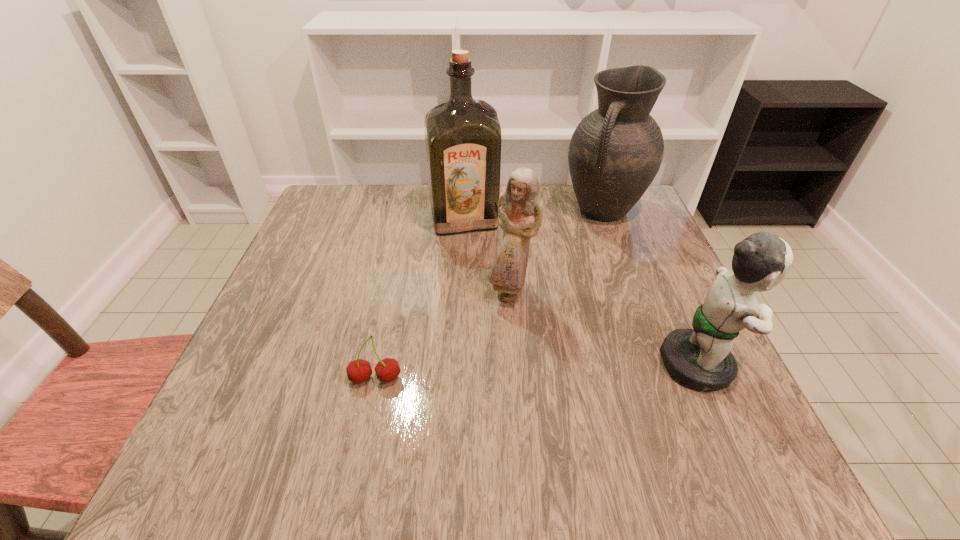
Identify which object is the third nearest to the leftmost object. Please provide its 2D coordinates. Your answer should be formatted as a tuple, i.e. [(x, y)], where the tuple contains the x and y coordinates of a point satisfying the conditions above.

[(701, 358)]

Locate which object ranks second in proximity to the fourth shortest object. Please provide its 2D coordinates. Your answer should be formatted as a tuple, i.e. [(x, y)], where the tuple contains the x and y coordinates of a point satisfying the conditions above.

[(520, 209)]

Where is `free location that satisfies the following two spatial constraints: 1. on the back side of the second tallest object; 2. on the right side of the liquor`? The image size is (960, 540). free location that satisfies the following two spatial constraints: 1. on the back side of the second tallest object; 2. on the right side of the liquor is located at coordinates (465, 210).

Locate an element on the screen. This screenshot has height=540, width=960. vacant space that satisfies the following two spatial constraints: 1. on the front side of the pitcher; 2. on the front-facing side of the right figurine is located at coordinates (660, 364).